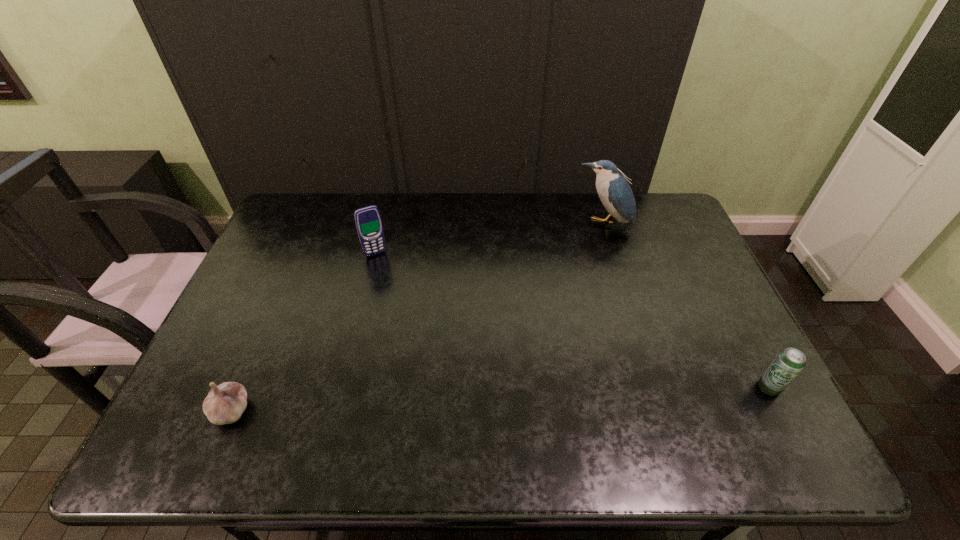
Where is `vacant area between the leftmost object and the third nearest object`? The height and width of the screenshot is (540, 960). vacant area between the leftmost object and the third nearest object is located at coordinates (303, 332).

You are a GUI agent. You are given a task and a screenshot of the screen. Output one action in this format:
    pyautogui.click(x=<x>, y=<y>)
    Task: Click on the vacant point located between the leftmost object and the bird
    
    Given the screenshot: What is the action you would take?
    pyautogui.click(x=417, y=317)

What are the coordinates of `free space between the rightmost object and the third shortest object` in the screenshot? It's located at (572, 320).

At what (x,y) coordinates should I click in order to perform the action: click on empty space that is in between the garlic and the third nearest object. Please return your answer as a coordinate pair (x, y). Looking at the image, I should click on (303, 332).

The image size is (960, 540). Identify the location of free area in between the farthest object and the leftmost object. (417, 317).

The height and width of the screenshot is (540, 960). In order to click on free space between the third nearest object and the third object from left to right in this screenshot , I will do `click(489, 239)`.

Identify the location of free space between the second farthest object and the rightmost object. (572, 320).

Where is `empty location between the rightmost object and the garlic`? The image size is (960, 540). empty location between the rightmost object and the garlic is located at coordinates (500, 399).

Find the location of a particular element. This screenshot has width=960, height=540. object that is the closest to the leftmost object is located at coordinates (368, 221).

Identify which object is the second closest to the third object from right to left. Please provide its 2D coordinates. Your answer should be formatted as a tuple, i.e. [(x, y)], where the tuple contains the x and y coordinates of a point satisfying the conditions above.

[(615, 193)]